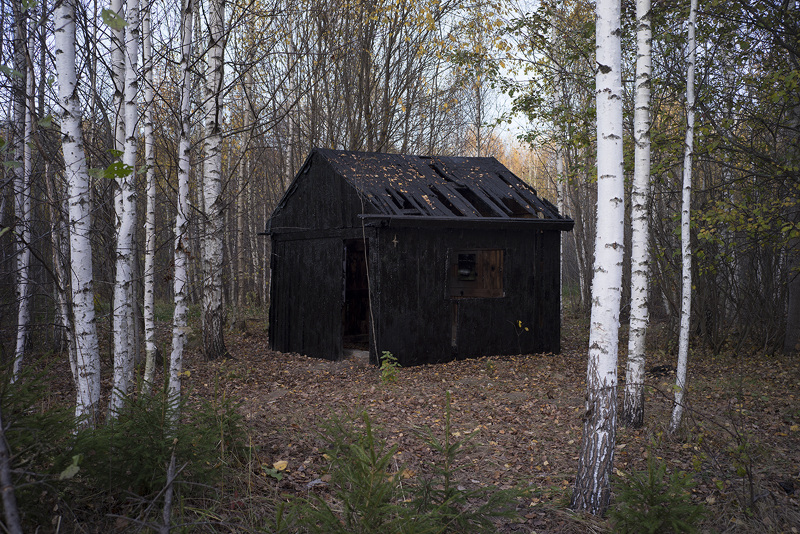
You are a GUI agent. You are given a task and a screenshot of the screen. Output one action in this format:
    pyautogui.click(x=<x>, y=<y>)
    Task: Click on the floor inside cabin
    
    Given the screenshot: What is the action you would take?
    pyautogui.click(x=360, y=358)